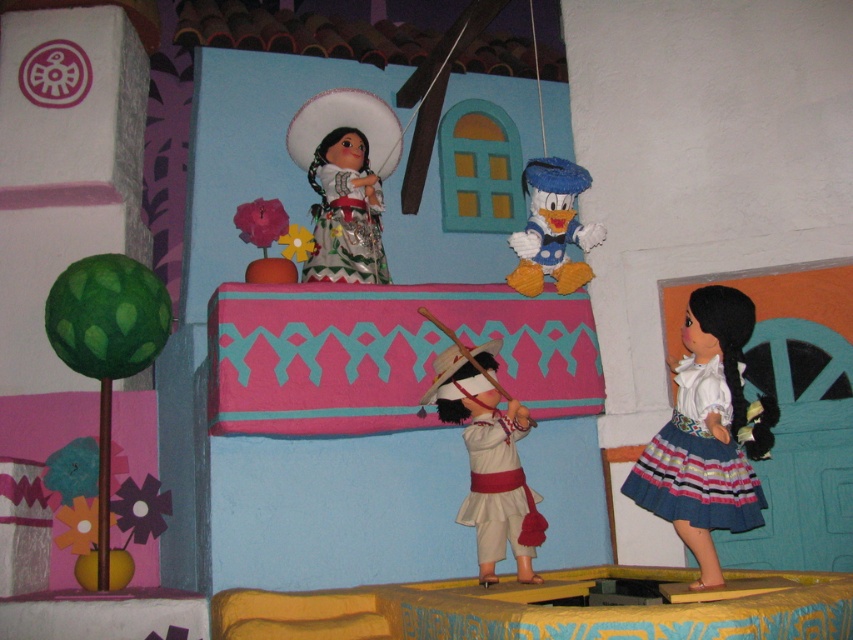
Question: Which point is closer to the camera?

Choices:
 (A) matte yellow plush duck at center
 (B) white cotton dress at center

Answer: (B)

Question: Considering the real-world distances, which object is closest to the white cotton dress at center?

Choices:
 (A) striped cotton skirt at lower right
 (B) embroidered cotton dress at upper center
 (C) white matte doll at center

Answer: (C)

Question: Can you confirm if matte white doll at upper center is positioned to the left of embroidered cotton dress at upper center?

Choices:
 (A) no
 (B) yes

Answer: (B)

Question: Where is matte white doll at upper center located in relation to embroidered cotton dress at upper center in the image?

Choices:
 (A) left
 (B) right

Answer: (A)

Question: Which point is closer to the camera taking this photo?

Choices:
 (A) (654, 477)
 (B) (351, 173)

Answer: (A)

Question: Can you confirm if striped cotton skirt at lower right is positioned above embroidered cotton dress at upper center?

Choices:
 (A) yes
 (B) no

Answer: (B)